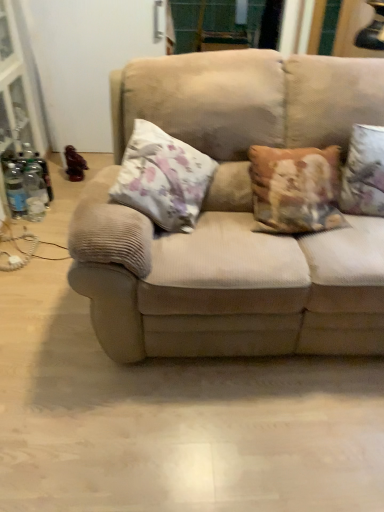
Question: Is wooden statue at left thinner than beige corduroy couch at center?

Choices:
 (A) yes
 (B) no

Answer: (A)

Question: From a real-world perspective, is wooden statue at left on beige corduroy couch at center?

Choices:
 (A) no
 (B) yes

Answer: (A)

Question: Is wooden statue at left turned away from beige corduroy couch at center?

Choices:
 (A) yes
 (B) no

Answer: (B)

Question: Is wooden statue at left in contact with beige corduroy couch at center?

Choices:
 (A) no
 (B) yes

Answer: (A)

Question: From a real-world perspective, is wooden statue at left below beige corduroy couch at center?

Choices:
 (A) no
 (B) yes

Answer: (B)

Question: Is wooden statue at left shorter than beige corduroy couch at center?

Choices:
 (A) yes
 (B) no

Answer: (A)

Question: Is floral fabric pillow at center, arranged as the second pillow when viewed from the right, positioned behind wooden statue at left?

Choices:
 (A) yes
 (B) no

Answer: (B)

Question: Is floral fabric pillow at center, arranged as the second pillow when viewed from the right, bigger than wooden statue at left?

Choices:
 (A) yes
 (B) no

Answer: (A)

Question: From a real-world perspective, is floral fabric pillow at center, arranged as the second pillow when viewed from the right, physically below wooden statue at left?

Choices:
 (A) yes
 (B) no

Answer: (B)

Question: Does floral fabric pillow at center, the first pillow in the left-to-right sequence, come in front of wooden statue at left?

Choices:
 (A) yes
 (B) no

Answer: (A)

Question: Considering the relative sizes of floral fabric pillow at center, arranged as the second pillow when viewed from the right, and wooden statue at left in the image provided, is floral fabric pillow at center, arranged as the second pillow when viewed from the right, smaller than wooden statue at left?

Choices:
 (A) yes
 (B) no

Answer: (B)

Question: Is wooden statue at left a part of floral fabric pillow at center, the first pillow in the left-to-right sequence?

Choices:
 (A) yes
 (B) no

Answer: (B)

Question: Is floral fabric pillow at right, acting as the 2th pillow starting from the left, not inside beige corduroy couch at center?

Choices:
 (A) no
 (B) yes

Answer: (A)